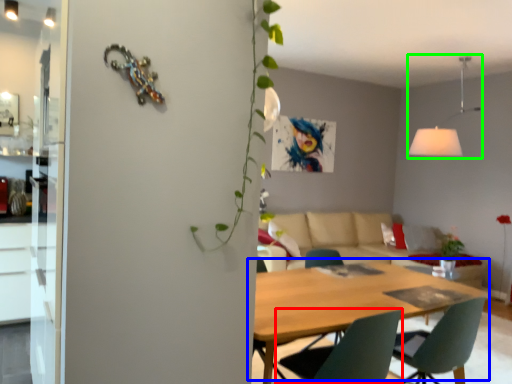
Question: Considering the real-world distances, which object is farthest from chair (highlighted by a red box)? kitchen & dining room table (highlighted by a blue box) or light fixture (highlighted by a green box)?

Choices:
 (A) kitchen & dining room table
 (B) light fixture

Answer: (B)